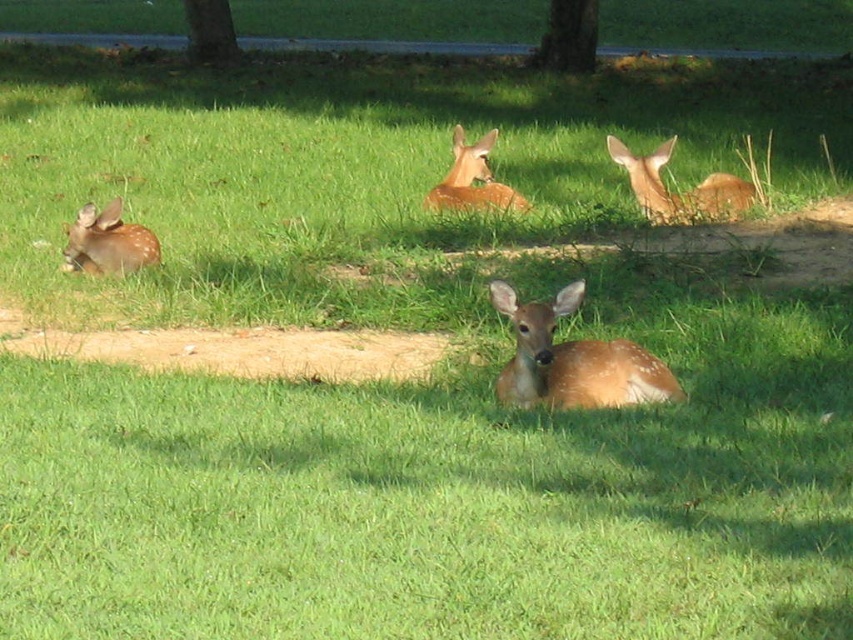
Question: Which point is closer to the camera taking this photo?

Choices:
 (A) (514, 310)
 (B) (744, 186)
 (C) (194, 33)
 (D) (112, 243)

Answer: (A)

Question: Is fawn fur deer at left in front of green rough bark tree at upper center?

Choices:
 (A) yes
 (B) no

Answer: (A)

Question: Is fawn fur deer at center below green rough bark tree at upper center?

Choices:
 (A) no
 (B) yes

Answer: (B)

Question: Does fawn fur deer at center appear on the left side of brown speckled fur at upper right?

Choices:
 (A) yes
 (B) no

Answer: (A)

Question: Which is farther from the green rough bark tree at upper center?

Choices:
 (A) brown speckled fur at upper right
 (B) fawn fur deer at center

Answer: (B)

Question: Which object is the farthest from the green rough bark tree at upper center?

Choices:
 (A) fawn fur deer at left
 (B) fawn fur deer at center
 (C) brown speckled fur at upper right

Answer: (B)